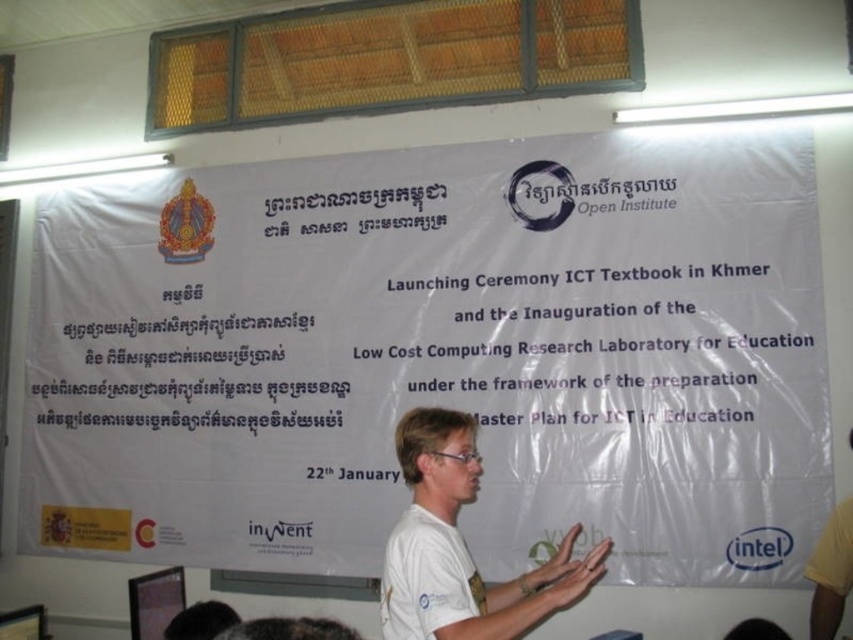
Question: Which point appears farthest from the camera in this image?

Choices:
 (A) (573, 570)
 (B) (54, 246)
 (C) (498, 596)

Answer: (B)

Question: Does white paper at center appear on the right side of white matte hand at center?

Choices:
 (A) no
 (B) yes

Answer: (A)

Question: Does white matte shirt at center have a greater width compared to white matte hand at center?

Choices:
 (A) no
 (B) yes

Answer: (B)

Question: Does white paper at center appear on the right side of white matte hand at center?

Choices:
 (A) yes
 (B) no

Answer: (B)

Question: Which of the following is the farthest from the observer?

Choices:
 (A) white matte shirt at center
 (B) white paper at center
 (C) white matte hand at center

Answer: (B)

Question: Which is nearer to the white matte shirt at center?

Choices:
 (A) white matte hand at center
 (B) white paper at center

Answer: (A)